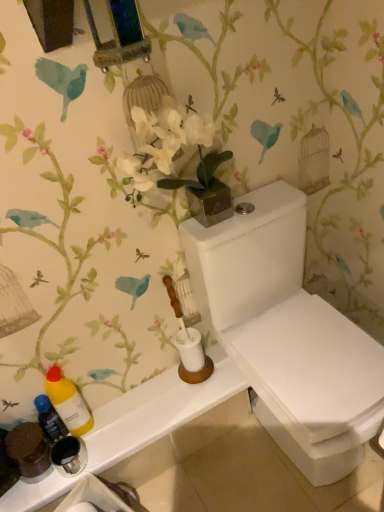
Question: Is white ceramic toilet brush at center aimed at translucent plastic bottle at lower left, which is counted as the second bottle, starting from the right?

Choices:
 (A) yes
 (B) no

Answer: (B)

Question: Considering the relative positions of white ceramic toilet brush at center and translucent plastic bottle at lower left, positioned as the 1th bottle in left-to-right order, in the image provided, is white ceramic toilet brush at center to the right of translucent plastic bottle at lower left, positioned as the 1th bottle in left-to-right order, from the viewer's perspective?

Choices:
 (A) no
 (B) yes

Answer: (B)

Question: Is white ceramic toilet brush at center located outside translucent plastic bottle at lower left, which is counted as the second bottle, starting from the right?

Choices:
 (A) yes
 (B) no

Answer: (A)

Question: Does white ceramic toilet brush at center have a smaller size compared to translucent plastic bottle at lower left, positioned as the 1th bottle in left-to-right order?

Choices:
 (A) yes
 (B) no

Answer: (B)

Question: Is white ceramic toilet brush at center facing away from translucent plastic bottle at lower left, positioned as the 1th bottle in left-to-right order?

Choices:
 (A) yes
 (B) no

Answer: (B)

Question: Considering the relative positions of white ceramic toilet brush at center and white glossy toilet at center in the image provided, is white ceramic toilet brush at center to the left or to the right of white glossy toilet at center?

Choices:
 (A) right
 (B) left

Answer: (B)

Question: Is white ceramic toilet brush at center taller or shorter than white glossy toilet at center?

Choices:
 (A) short
 (B) tall

Answer: (A)

Question: Is point (182, 337) positioned closer to the camera than point (273, 240)?

Choices:
 (A) closer
 (B) farther

Answer: (B)

Question: Looking at their shapes, would you say white ceramic toilet brush at center is wider or thinner than white glossy toilet at center?

Choices:
 (A) thin
 (B) wide

Answer: (A)

Question: Is white glossy counter top at lower left in front of or behind white ceramic toilet brush at center in the image?

Choices:
 (A) behind
 (B) front

Answer: (A)

Question: Visually, is white glossy counter top at lower left positioned to the left or to the right of white ceramic toilet brush at center?

Choices:
 (A) left
 (B) right

Answer: (A)

Question: From the image's perspective, is white glossy counter top at lower left positioned above or below white ceramic toilet brush at center?

Choices:
 (A) below
 (B) above

Answer: (A)

Question: From a real-world perspective, is white glossy counter top at lower left physically located above or below white ceramic toilet brush at center?

Choices:
 (A) below
 (B) above

Answer: (A)

Question: Is point (170, 298) closer or farther from the camera than point (69, 480)?

Choices:
 (A) farther
 (B) closer

Answer: (A)

Question: From the image's perspective, is white ceramic toilet brush at center positioned above or below white glossy counter top at lower left?

Choices:
 (A) below
 (B) above

Answer: (B)